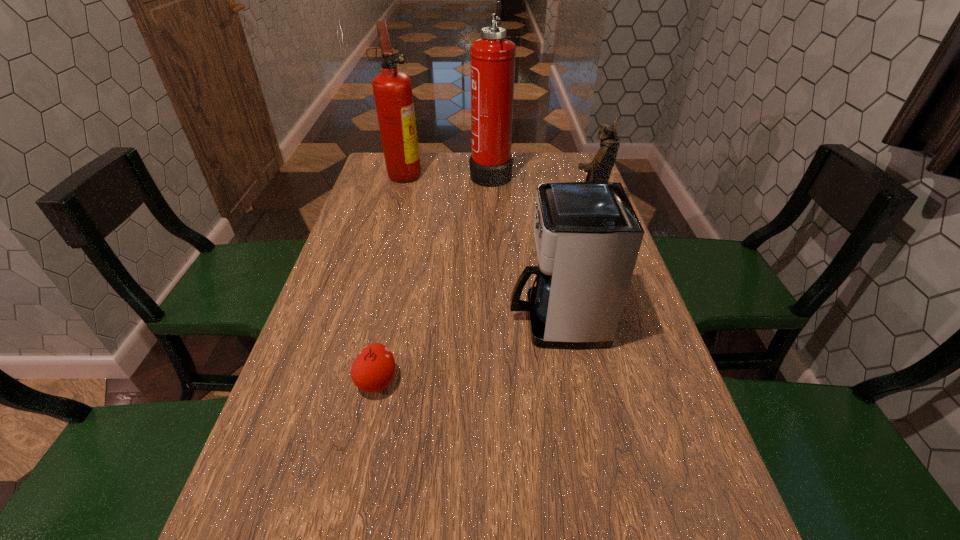
What are the coordinates of `the right fire extinguisher` in the screenshot? It's located at (492, 58).

Where is `the fourth shortest object`? Image resolution: width=960 pixels, height=540 pixels. the fourth shortest object is located at coordinates (392, 89).

Where is `the left fire extinguisher`? the left fire extinguisher is located at coordinates (392, 89).

You are a GUI agent. You are given a task and a screenshot of the screen. Output one action in this format:
    pyautogui.click(x=<x>, y=<y>)
    Task: Click on the coffee maker
    
    Given the screenshot: What is the action you would take?
    pyautogui.click(x=587, y=235)

Locate an element on the screen. figurine is located at coordinates (599, 170).

Where is `the shortest object`? the shortest object is located at coordinates (373, 369).

The height and width of the screenshot is (540, 960). Identify the location of the nearest object. (373, 369).

You are a GUI agent. You are given a task and a screenshot of the screen. Output one action in this format:
    pyautogui.click(x=<x>, y=<y>)
    Task: Click on the free spot located on the front-facing side of the right fire extinguisher
    
    Given the screenshot: What is the action you would take?
    pyautogui.click(x=432, y=173)

Locate an element on the screen. The width and height of the screenshot is (960, 540). vacant space located on the front-facing side of the right fire extinguisher is located at coordinates (371, 173).

Locate an element on the screen. free space located on the front-facing side of the right fire extinguisher is located at coordinates (432, 173).